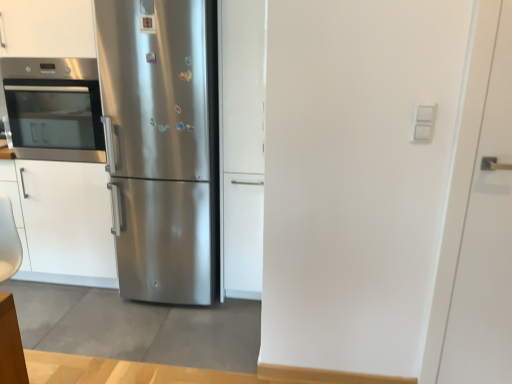
Question: Would you say stainless steel oven at left is to the left or to the right of white matte door at right, which is the 1th door in right-to-left order, in the picture?

Choices:
 (A) right
 (B) left

Answer: (B)

Question: Is stainless steel oven at left wider or thinner than white matte door at right, arranged as the second door when viewed from the left?

Choices:
 (A) thin
 (B) wide

Answer: (B)

Question: Which object is the closest to the stainless steel refrigerator at center?

Choices:
 (A) satin white cabinet at center, the 2th door viewed from the front
 (B) white matte door at right, arranged as the first door when viewed from the front
 (C) stainless steel oven at left

Answer: (A)

Question: Which of these objects is positioned closest to the stainless steel refrigerator at center?

Choices:
 (A) white matte door at right, arranged as the first door when viewed from the front
 (B) satin white cabinet at center, marked as the 2th door in a right-to-left arrangement
 (C) stainless steel oven at left

Answer: (B)